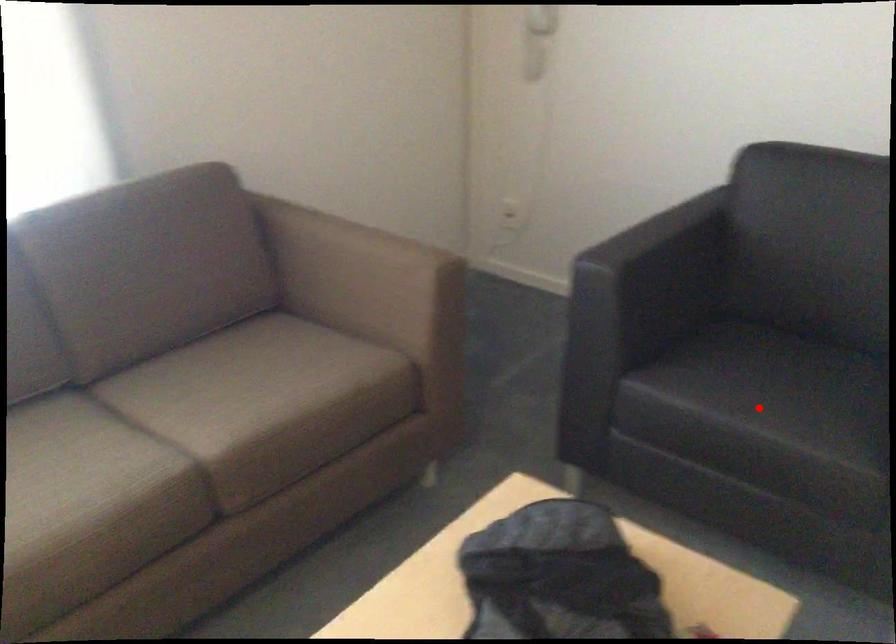
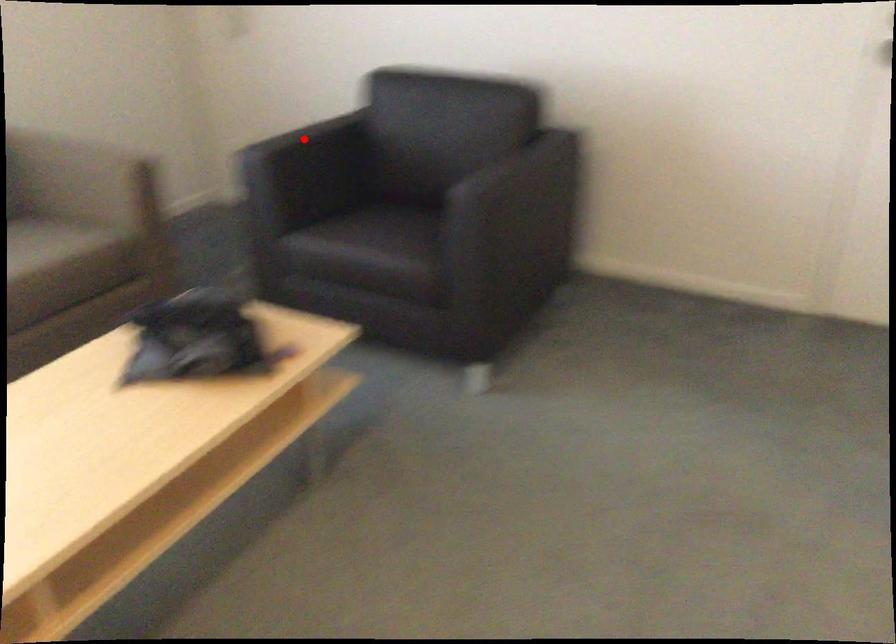
I am providing you with two images of the same scene from different viewpoints. A red point is marked on the first image and another point is marked on the second image. Does the point marked in image1 correspond to the same location as the one in image2?

No